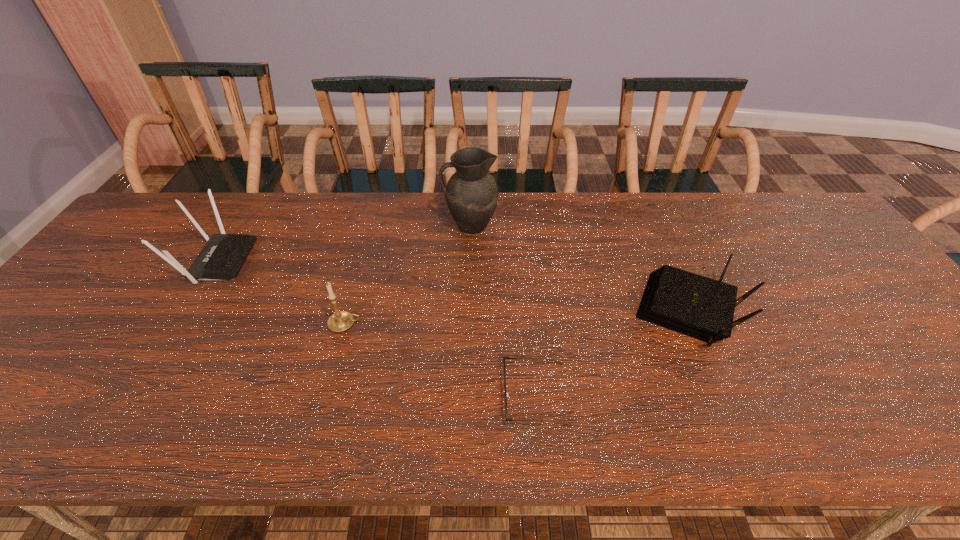
Identify the location of the tallest object. (471, 193).

At what (x,y) coordinates should I click in order to perform the action: click on the leftmost object. Please return your answer as a coordinate pair (x, y). The width and height of the screenshot is (960, 540). Looking at the image, I should click on (221, 258).

You are a GUI agent. You are given a task and a screenshot of the screen. Output one action in this format:
    pyautogui.click(x=<x>, y=<y>)
    Task: Click on the taller router
    
    Given the screenshot: What is the action you would take?
    pyautogui.click(x=221, y=258)

The width and height of the screenshot is (960, 540). I want to click on candle holder, so click(340, 321).

Identify the location of the shorter router. The width and height of the screenshot is (960, 540). (699, 307).

This screenshot has height=540, width=960. I want to click on the fourth tallest object, so click(x=699, y=307).

Identify the location of spectacles. Image resolution: width=960 pixels, height=540 pixels. pos(504,357).

This screenshot has width=960, height=540. What are the coordinates of `the shortest object` in the screenshot? It's located at (504, 357).

Where is `free space located on the side of the tallest object with the handle`? Image resolution: width=960 pixels, height=540 pixels. free space located on the side of the tallest object with the handle is located at coordinates (358, 226).

Locate an element on the screen. free location located on the side of the tallest object with the handle is located at coordinates (361, 226).